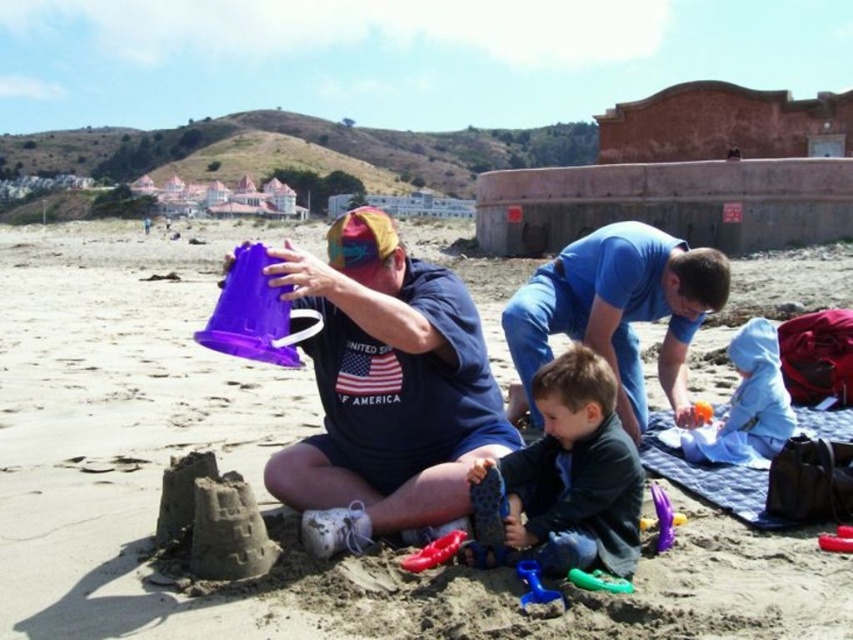
You are a beachgoer who wants to store your belongings in a container. You have two options available on the beach, the matte purple bucket at center and the blue rubber boot at lower center. Which container can hold more items vertically?

The matte purple bucket at center has a greater height compared to the blue rubber boot at lower center, so it can hold more items vertically.

You are a lifeguard standing at the edge of the water and need to retrieve an object. You see the matte purple bucket at center and the blue rubber boot at lower center. Which object is farther from your current position?

The blue rubber boot at lower center is farther from your current position because the distance between the matte purple bucket at center and the blue rubber boot at lower center is 7.41 meters, so whichever object is not closer would be farther. However, without knowing the exact positions relative to the lifeguard, it is impossible to determine which is farther. The question cannot be answered with the given information.

You are a photographer trying to capture a closeup of the blue cotton shirt at center and the rubber red toy at lower center. Since you want both objects to appear the same size in the photo, which object should you move closer to the camera?

Since the blue cotton shirt at center is wider than the rubber red toy at lower center, you should move the blue cotton shirt at center closer to the camera to make it appear the same size as the rubber red toy at lower center in the photo.